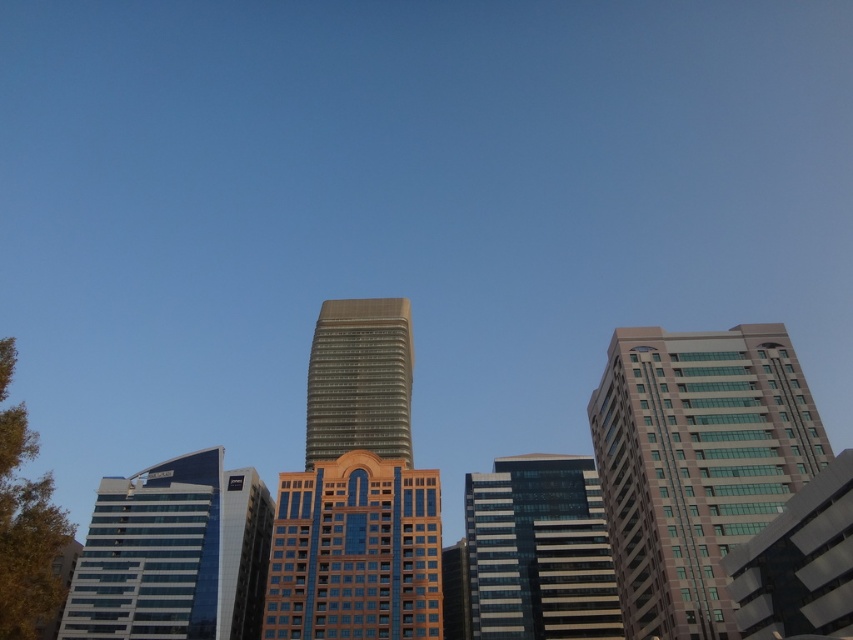
Is point (136, 624) positioned in front of point (328, 355)?

Yes, point (136, 624) is in front of point (328, 355).

Which is more to the right, blue glass building at left or gold glass tower at center?

gold glass tower at center

Does point (96, 566) come in front of point (346, 349)?

Yes.

Image resolution: width=853 pixels, height=640 pixels. What are the coordinates of `blue glass building at left` in the screenshot? It's located at (173, 554).

Which is behind, point (289, 614) or point (373, 332)?

Point (373, 332)

Is gold glass building at center shorter than gold glass tower at center?

Yes.

Is point (340, 589) positioned after point (399, 346)?

That is False.

Identify the location of gold glass building at center. (355, 552).

The height and width of the screenshot is (640, 853). Identify the location of matte glass building at right. (695, 465).

Is matte glass building at right positioned in front of blue glass building at left?

That is True.

You are a GUI agent. You are given a task and a screenshot of the screen. Output one action in this format:
    pyautogui.click(x=<x>, y=<y>)
    Task: Click on the matte glass building at right
    The width and height of the screenshot is (853, 640).
    Given the screenshot: What is the action you would take?
    pyautogui.click(x=695, y=465)